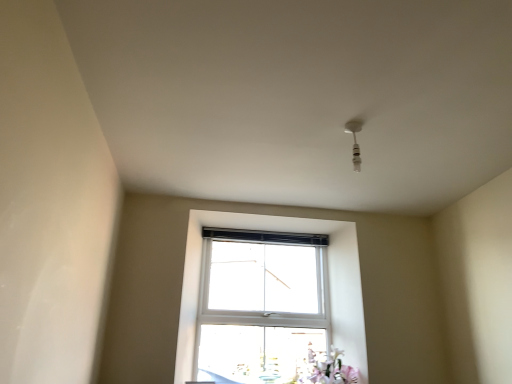
Identify the location of pink matte flower at lower right. This screenshot has height=384, width=512. (330, 371).

The height and width of the screenshot is (384, 512). What do you see at coordinates (330, 371) in the screenshot?
I see `pink matte flower at lower right` at bounding box center [330, 371].

In order to face pink matte flower at lower right, should I rotate leftwards or rightwards?

Turn right by 9.517 degrees to look at pink matte flower at lower right.

Measure the distance between point (362, 120) and camera.

Point (362, 120) is 6.70 feet away from camera.

This screenshot has width=512, height=384. What do you see at coordinates (355, 140) in the screenshot? I see `white plastic light fixture at upper center` at bounding box center [355, 140].

The image size is (512, 384). Find the location of `white plastic light fixture at upper center`. white plastic light fixture at upper center is located at coordinates (355, 140).

The width and height of the screenshot is (512, 384). What are the coordinates of `pink matte flower at lower right` in the screenshot? It's located at (330, 371).

Can you confirm if white plastic light fixture at upper center is positioned to the left of pink matte flower at lower right?

No, white plastic light fixture at upper center is not to the left of pink matte flower at lower right.

Is white plastic light fixture at upper center positioned in front of pink matte flower at lower right?

Yes, it is.

Considering the positions of points (359, 158) and (352, 371), is point (359, 158) farther from camera compared to point (352, 371)?

That is False.

From the image's perspective, which is below, white plastic light fixture at upper center or pink matte flower at lower right?

pink matte flower at lower right is shown below in the image.

From a real-world perspective, is white plastic light fixture at upper center beneath pink matte flower at lower right?

No, from a real-world perspective, white plastic light fixture at upper center is not beneath pink matte flower at lower right.

Is white plastic light fixture at upper center wider or thinner than pink matte flower at lower right?

white plastic light fixture at upper center is thinner than pink matte flower at lower right.

Is white plastic light fixture at upper center taller or shorter than pink matte flower at lower right?

In the image, white plastic light fixture at upper center appears to be shorter than pink matte flower at lower right.

Between white plastic light fixture at upper center and pink matte flower at lower right, which one has larger size?

pink matte flower at lower right is bigger.

Is white plastic light fixture at upper center completely or partially outside of pink matte flower at lower right?

Yes.

Is white plastic light fixture at upper center not close to pink matte flower at lower right?

Absolutely, white plastic light fixture at upper center is distant from pink matte flower at lower right.

Could you tell me if white plastic light fixture at upper center is turned towards pink matte flower at lower right?

No, white plastic light fixture at upper center does not turn towards pink matte flower at lower right.

How far apart are white plastic light fixture at upper center and pink matte flower at lower right?

white plastic light fixture at upper center and pink matte flower at lower right are 1.47 meters apart from each other.

What are the coordinates of `light fixture above the pink matte flower at lower right (from the image's perspective)` in the screenshot? It's located at (355, 140).

Considering the relative positions of pink matte flower at lower right and white plastic light fixture at upper center in the image provided, is pink matte flower at lower right to the right of white plastic light fixture at upper center from the viewer's perspective?

In fact, pink matte flower at lower right is to the left of white plastic light fixture at upper center.

Is pink matte flower at lower right positioned behind white plastic light fixture at upper center?

Yes.

Does point (331, 376) come farther from viewer compared to point (356, 121)?

Yes, it is behind point (356, 121).

From the image's perspective, which is below, pink matte flower at lower right or white plastic light fixture at upper center?

pink matte flower at lower right is shown below in the image.

From a real-world perspective, which is physically below, pink matte flower at lower right or white plastic light fixture at upper center?

pink matte flower at lower right is physically lower.

Is pink matte flower at lower right wider or thinner than white plastic light fixture at upper center?

Clearly, pink matte flower at lower right has more width compared to white plastic light fixture at upper center.

Consider the image. Is pink matte flower at lower right taller or shorter than white plastic light fixture at upper center?

Considering their sizes, pink matte flower at lower right has more height than white plastic light fixture at upper center.

Can you confirm if pink matte flower at lower right is bigger than white plastic light fixture at upper center?

Correct, pink matte flower at lower right is larger in size than white plastic light fixture at upper center.

Is pink matte flower at lower right not inside white plastic light fixture at upper center?

Yes, pink matte flower at lower right is outside of white plastic light fixture at upper center.

Consider the image. Is there a large distance between pink matte flower at lower right and white plastic light fixture at upper center?

Yes.

Could you tell me if pink matte flower at lower right is turned towards white plastic light fixture at upper center?

No, pink matte flower at lower right does not turn towards white plastic light fixture at upper center.

Based on the photo, how different are the orientations of pink matte flower at lower right and white plastic light fixture at upper center in degrees?

88.3 degrees separate the facing orientations of pink matte flower at lower right and white plastic light fixture at upper center.

In the image, there is a pink matte flower at lower right. Where is `light fixture above it (from the image's perspective)`? light fixture above it (from the image's perspective) is located at coordinates (355, 140).

Where is `flower located on the left of white plastic light fixture at upper center`? This screenshot has height=384, width=512. flower located on the left of white plastic light fixture at upper center is located at coordinates (330, 371).

The width and height of the screenshot is (512, 384). Identify the location of light fixture in front of the pink matte flower at lower right. (355, 140).